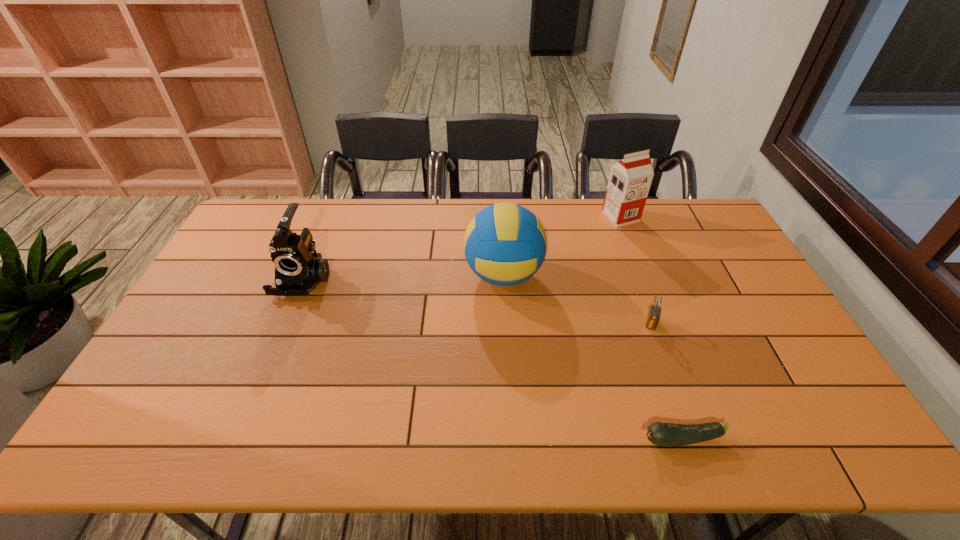
Identify which object is the second nearest to the farthest object. Please provide its 2D coordinates. Your answer should be formatted as a tuple, i.e. [(x, y)], where the tuple contains the x and y coordinates of a point satisfying the conditions above.

[(653, 317)]

Identify the location of object that is the third closest to the fourth object from right to left. (298, 270).

Locate an element on the screen. Image resolution: width=960 pixels, height=540 pixels. free space that satisfies the following two spatial constraints: 1. on the front side of the fourth object from right to left; 2. on the right side of the fourth farthest object is located at coordinates (506, 323).

This screenshot has width=960, height=540. Identify the location of vacant space that satisfies the following two spatial constraints: 1. on the back side of the soya milk; 2. on the left side of the fourth tallest object. (612, 217).

The width and height of the screenshot is (960, 540). Identify the location of vacant space that satisfies the following two spatial constraints: 1. on the back side of the volleyball; 2. on the left side of the soya milk. (500, 217).